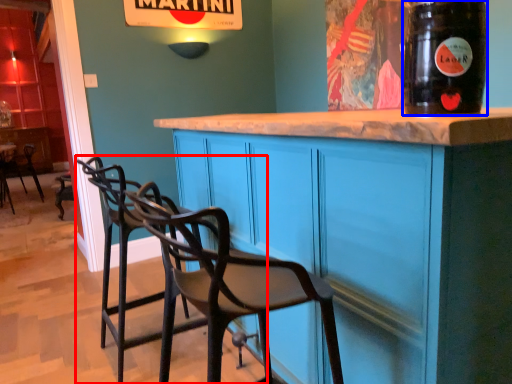
Question: Which point is closer to the camera, chair (highlighted by a red box) or drinking straw (highlighted by a blue box)?

Choices:
 (A) chair
 (B) drinking straw

Answer: (B)